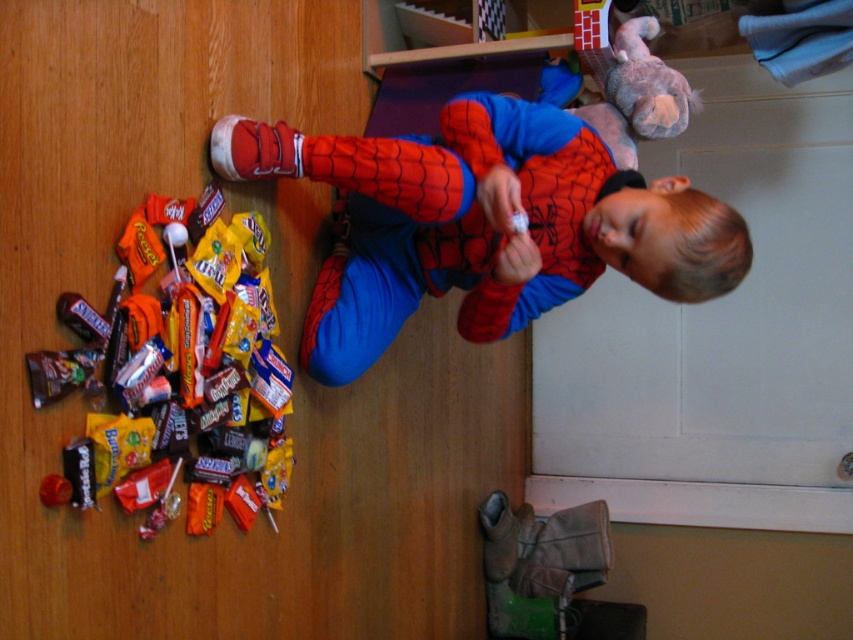
Question: Which object is farther from the camera taking this photo?

Choices:
 (A) shiny plastic candy at lower left
 (B) matte red costume at center
 (C) fluffy gray stuffed animal at upper right

Answer: (C)

Question: Can you confirm if shiny plastic candy at lower left is smaller than fluffy gray stuffed animal at upper right?

Choices:
 (A) yes
 (B) no

Answer: (B)

Question: Which point is farther to the camera?

Choices:
 (A) (422, 227)
 (B) (618, 56)
 (C) (257, 451)

Answer: (B)

Question: Which is nearer to the shiny plastic candy at lower left?

Choices:
 (A) matte red costume at center
 (B) fluffy gray stuffed animal at upper right

Answer: (A)

Question: Does matte red costume at center appear under fluffy gray stuffed animal at upper right?

Choices:
 (A) yes
 (B) no

Answer: (A)

Question: Is matte red costume at center below fluffy gray stuffed animal at upper right?

Choices:
 (A) no
 (B) yes

Answer: (B)